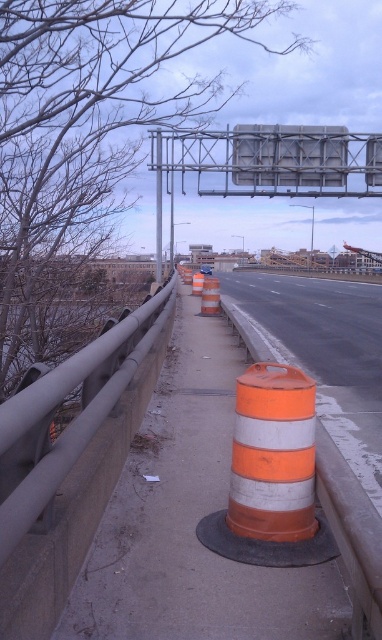
Question: Does orange/white striped traffic cone at center have a smaller size compared to orange striped traffic cone at center?

Choices:
 (A) no
 (B) yes

Answer: (B)

Question: Does orange/white striped traffic cone at center have a larger size compared to metallic gray sign at upper center?

Choices:
 (A) no
 (B) yes

Answer: (A)

Question: Among these points, which one is nearest to the camera?

Choices:
 (A) (278, 468)
 (B) (208, 300)
 (C) (205, 184)
 (D) (200, 284)

Answer: (A)

Question: Estimate the real-world distances between objects in this image. Which object is closer to the metallic gray sign at upper center?

Choices:
 (A) orange striped traffic cone at center
 (B) orange/white striped traffic cone at center

Answer: (A)

Question: Is orange striped traffic cone at center closer to camera compared to orange striped cone at center?

Choices:
 (A) no
 (B) yes

Answer: (B)

Question: Which point appears farthest from the camera in this image?

Choices:
 (A) (260, 477)
 (B) (213, 284)

Answer: (B)